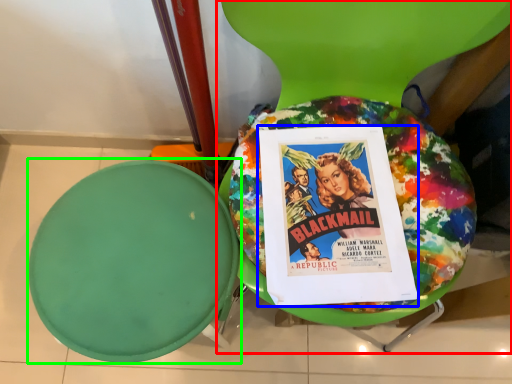
Question: Considering the real-world distances, which object is closest to chair (highlighted by a red box)? comic book (highlighted by a blue box) or round table (highlighted by a green box).

Choices:
 (A) comic book
 (B) round table

Answer: (A)